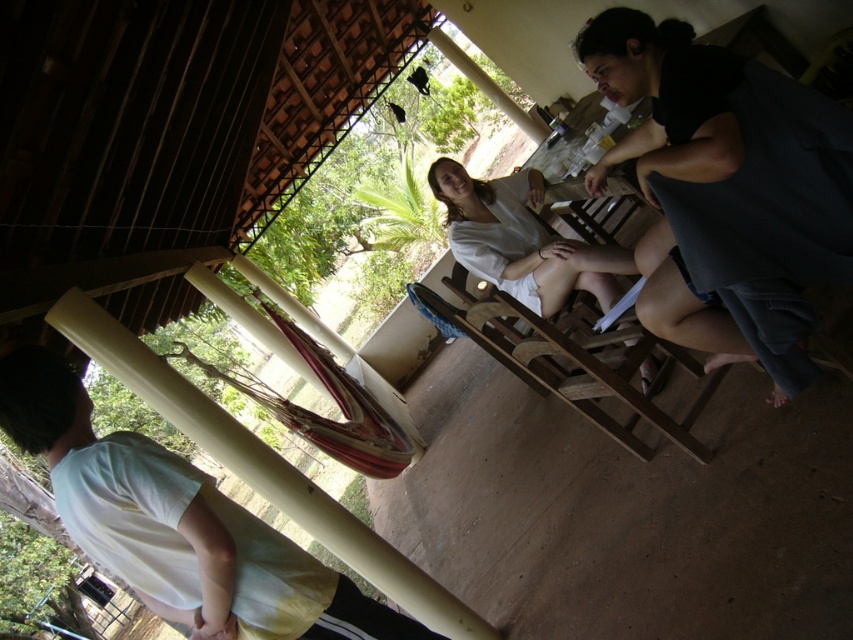
Question: Among these objects, which one is farthest from the camera?

Choices:
 (A) white cotton shirt at lower left
 (B) white cotton shirt at center

Answer: (B)

Question: Among these points, which one is farthest from the camera?

Choices:
 (A) (177, 476)
 (B) (532, 250)

Answer: (B)

Question: Is black cotton shorts at right thinner than white cotton shirt at center?

Choices:
 (A) yes
 (B) no

Answer: (A)

Question: From the image, what is the correct spatial relationship of black cotton shorts at right in relation to white cotton shirt at lower left?

Choices:
 (A) right
 (B) left

Answer: (A)

Question: Does black cotton shorts at right appear on the left side of white cotton shirt at lower left?

Choices:
 (A) yes
 (B) no

Answer: (B)

Question: Estimate the real-world distances between objects in this image. Which object is farther from the black cotton shorts at right?

Choices:
 (A) white cotton shirt at lower left
 (B) white cotton shirt at center

Answer: (A)